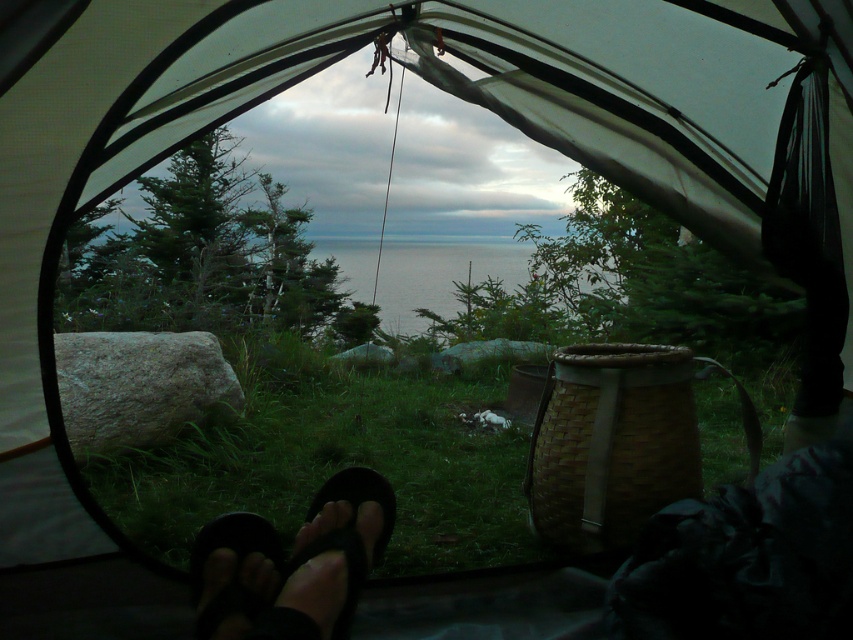
Question: Which of the following is the closest to the observer?

Choices:
 (A) black matte sandal at lower center
 (B) black rubber flip-flop at lower left
 (C) black rubber sandals at lower center

Answer: (C)

Question: In this image, where is black rubber sandals at lower center located relative to black rubber flip-flop at lower left?

Choices:
 (A) above
 (B) below

Answer: (A)

Question: Which object is the closest to the black rubber sandals at lower center?

Choices:
 (A) black matte sandal at lower center
 (B) black rubber flip-flop at lower left

Answer: (B)

Question: Which object is positioned closest to the black rubber sandals at lower center?

Choices:
 (A) black matte sandal at lower center
 (B) black rubber flip-flop at lower left

Answer: (B)

Question: Is black rubber sandals at lower center positioned at the back of black rubber flip-flop at lower left?

Choices:
 (A) yes
 (B) no

Answer: (B)

Question: Is black rubber flip-flop at lower left thinner than black matte sandal at lower center?

Choices:
 (A) no
 (B) yes

Answer: (B)